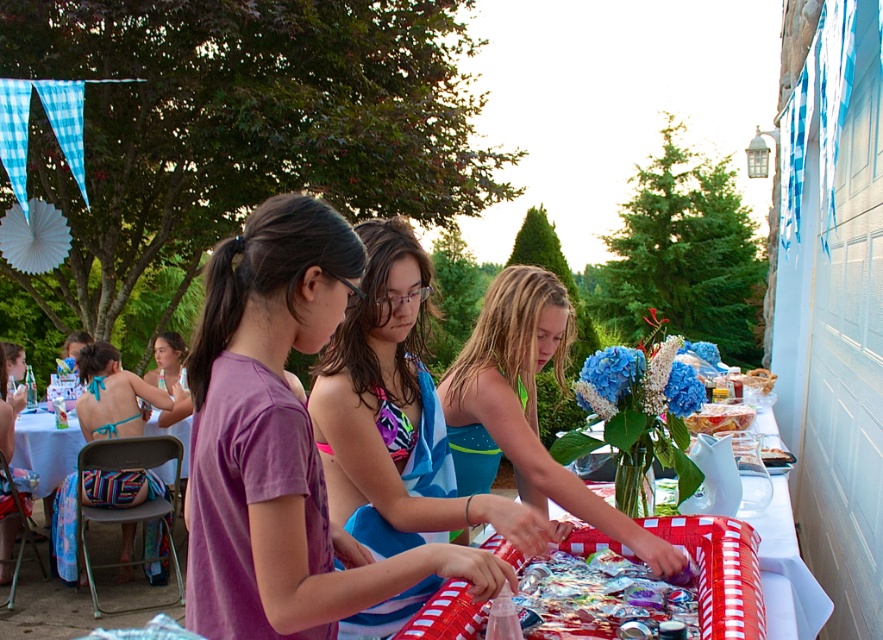
Question: Is striped fabric bikini bottom at lower left below smooth plastic container at center?

Choices:
 (A) yes
 (B) no

Answer: (B)

Question: Can you confirm if shiny metallic foil at center is positioned to the right of translucent plastic bag at center?

Choices:
 (A) yes
 (B) no

Answer: (B)

Question: Does striped fabric bikini bottom at lower left appear on the left side of smooth plastic container at center?

Choices:
 (A) yes
 (B) no

Answer: (A)

Question: Among these points, which one is farthest from the camera?

Choices:
 (A) (540, 369)
 (B) (789, 589)
 (C) (613, 595)

Answer: (A)

Question: Considering the real-world distances, which object is farthest from the purple cotton t-shirt at center?

Choices:
 (A) blonde hair at center
 (B) shiny plastic tray at right

Answer: (B)

Question: Which point is closer to the camera taking this photo?

Choices:
 (A) (591, 570)
 (B) (185, 474)
 (C) (668, 572)
 (D) (714, 611)

Answer: (D)